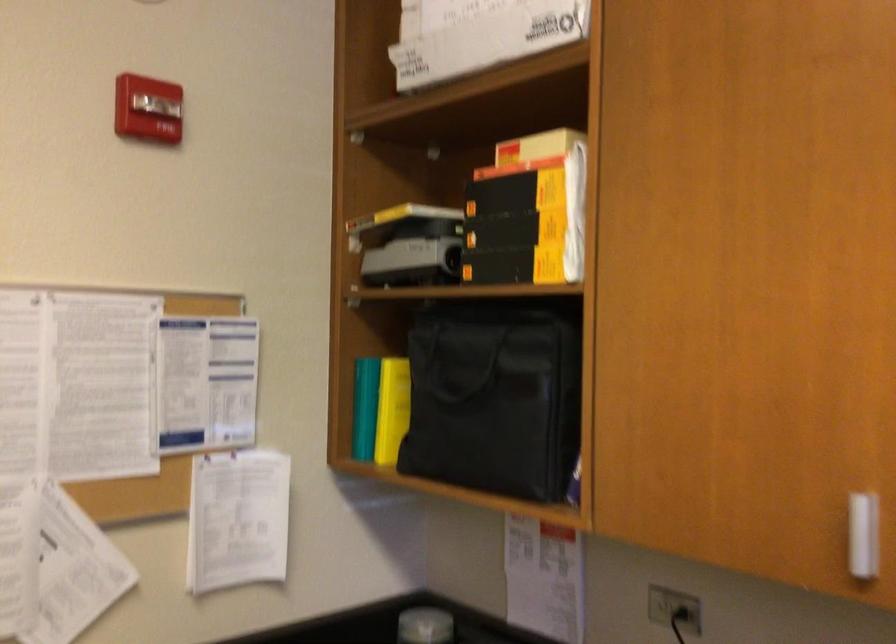
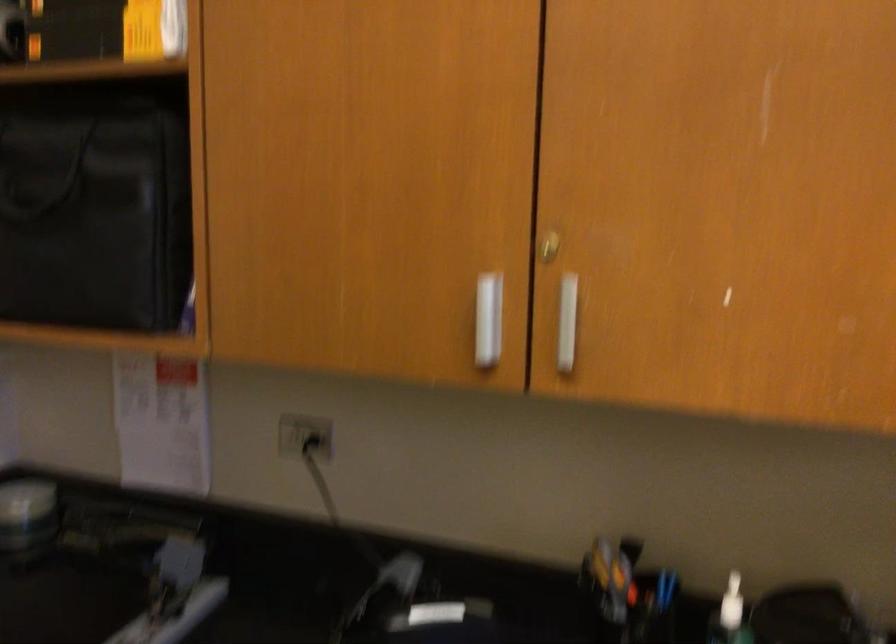
What movement of the cameraman would produce the second image?

The cameraman walked toward right, forward.